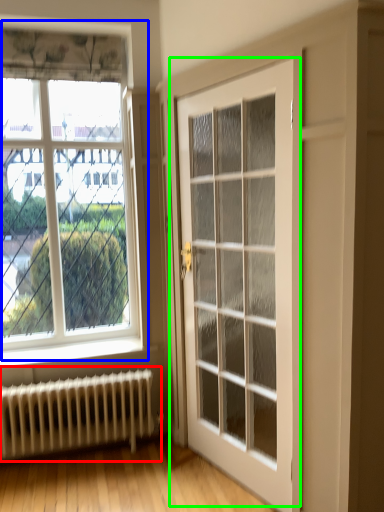
Question: Estimate the real-world distances between objects in this image. Which object is farther from radiator (highlighted by a red box), window (highlighted by a blue box) or door (highlighted by a green box)?

Choices:
 (A) window
 (B) door

Answer: (B)